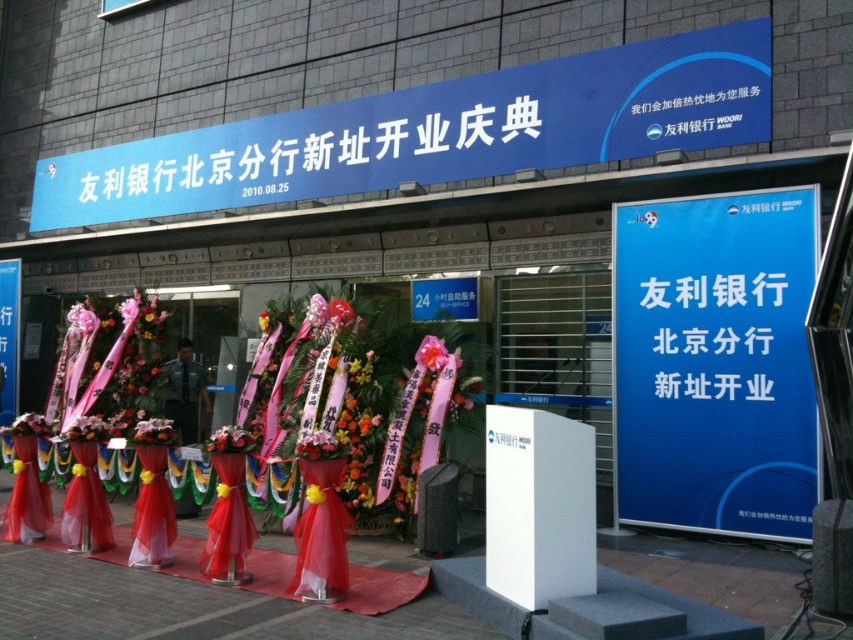
Based on the photo, which is below, blue paperboard sign at right or pink matte flower at center?

blue paperboard sign at right

Does blue paperboard sign at right have a greater width compared to pink matte flower at center?

Yes, blue paperboard sign at right is wider than pink matte flower at center.

Who is more forward, (692, 230) or (431, 355)?

Point (692, 230) is more forward.

I want to click on blue paperboard sign at right, so click(x=715, y=362).